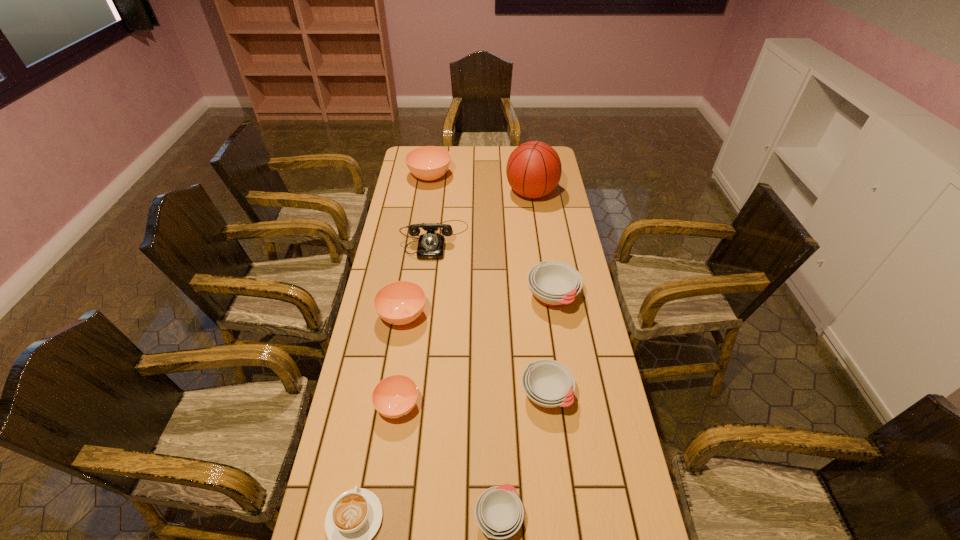
This screenshot has width=960, height=540. In order to click on free spot at the left edge of the desktop in this screenshot , I will do `click(371, 314)`.

At what (x,y) coordinates should I click in order to perform the action: click on vacant point at the right edge. Please return your answer as a coordinate pair (x, y). Looking at the image, I should click on (636, 493).

Where is `vacant region at the far left corner`? The width and height of the screenshot is (960, 540). vacant region at the far left corner is located at coordinates (415, 146).

Locate an element on the screen. Image resolution: width=960 pixels, height=540 pixels. free space between the second nearest peach soup bowl and the second biggest white soup bowl is located at coordinates (474, 355).

Locate an element on the screen. Image resolution: width=960 pixels, height=540 pixels. free point between the second biggest peach soup bowl and the seventh nearest object is located at coordinates (419, 278).

In order to click on vacant space in between the biggest white soup bowl and the third farthest object in this screenshot , I will do `click(493, 268)`.

Identify the location of free area in between the second biggest peach soup bowl and the tallest object. This screenshot has height=540, width=960. (468, 254).

I want to click on vacant area that lies between the second nearest white soup bowl and the second nearest peach soup bowl, so pos(474,355).

Identify the location of free area in between the second smallest peach soup bowl and the nearest peach soup bowl. (400, 361).

Locate an element on the screen. The image size is (960, 540). object that is the seventh closest to the third farthest object is located at coordinates (353, 519).